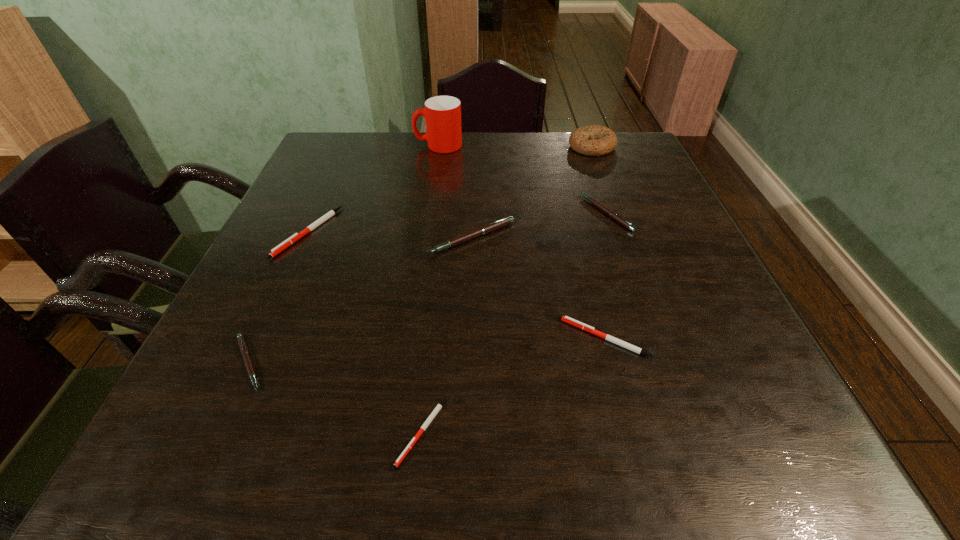
Identify the location of free region located at the nib of the rightmost pink pen. (506, 213).

Where is `vacant space located 0.230m at the nib of the rightmost pink pen`? The height and width of the screenshot is (540, 960). vacant space located 0.230m at the nib of the rightmost pink pen is located at coordinates (490, 213).

Where is `free space located 0.300m at the nib of the rightmost pink pen`? This screenshot has width=960, height=540. free space located 0.300m at the nib of the rightmost pink pen is located at coordinates (461, 213).

Image resolution: width=960 pixels, height=540 pixels. What are the coordinates of `free location located on the clicker of the farthest white pen` in the screenshot? It's located at click(x=245, y=373).

Where is `free region located at the nib of the smallest pink pen`? This screenshot has width=960, height=540. free region located at the nib of the smallest pink pen is located at coordinates (447, 363).

The height and width of the screenshot is (540, 960). I want to click on free space located on the clicker of the second farthest white pen, so click(x=477, y=338).

Where is `free space located on the clicker of the second farthest white pen`? The height and width of the screenshot is (540, 960). free space located on the clicker of the second farthest white pen is located at coordinates (427, 338).

At what (x,y) coordinates should I click in order to perform the action: click on free spot located 0.250m on the clicker of the second farthest white pen. Please return your answer as a coordinate pair (x, y). The height and width of the screenshot is (540, 960). Looking at the image, I should click on (421, 338).

Identify the location of cup situated at the far edge. (442, 114).

Find the location of a particular element. bagel located at the far edge is located at coordinates (594, 140).